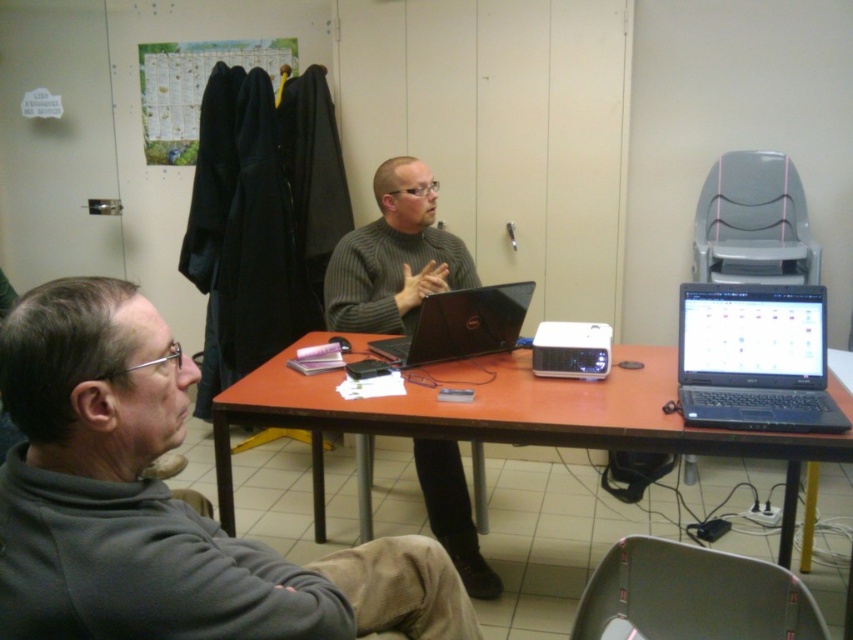
In the scene shown: You are a delivery person who needs to place a small package between the gray fleece jacket at lower left and the black matte laptop at right. Can you fit the package between them?

The gray fleece jacket at lower left is closer to the viewer than the black matte laptop at right, so there is space between them for the package to fit.